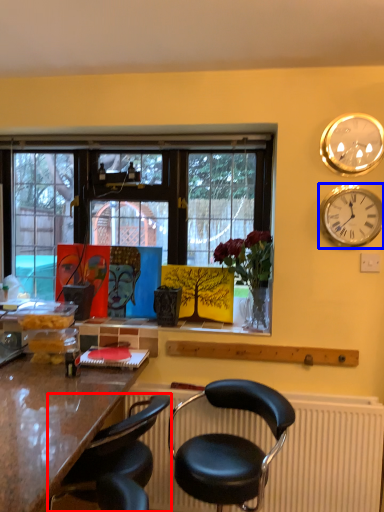
Question: Which object is further to the camera taking this photo, chair (highlighted by a red box) or wall clock (highlighted by a blue box)?

Choices:
 (A) chair
 (B) wall clock

Answer: (B)